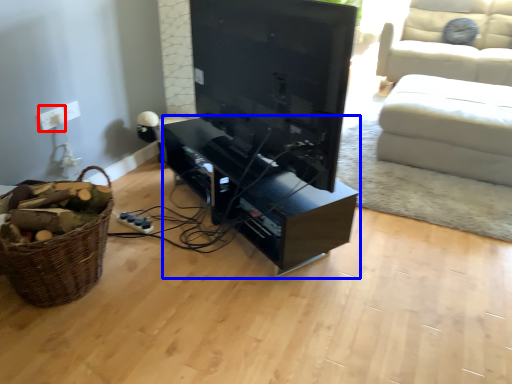
Question: Which object appears closest to the camera in this image, electric outlet (highlighted by a red box) or entertainment center (highlighted by a blue box)?

Choices:
 (A) electric outlet
 (B) entertainment center

Answer: (B)